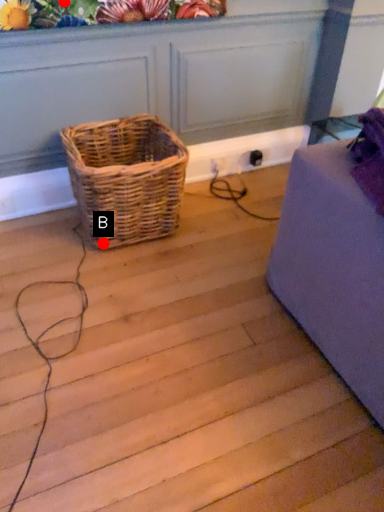
Question: Two points are circled on the image, labeled by A and B beside each circle. Among these points, which one is nearest to the camera?

Choices:
 (A) A is closer
 (B) B is closer

Answer: (A)